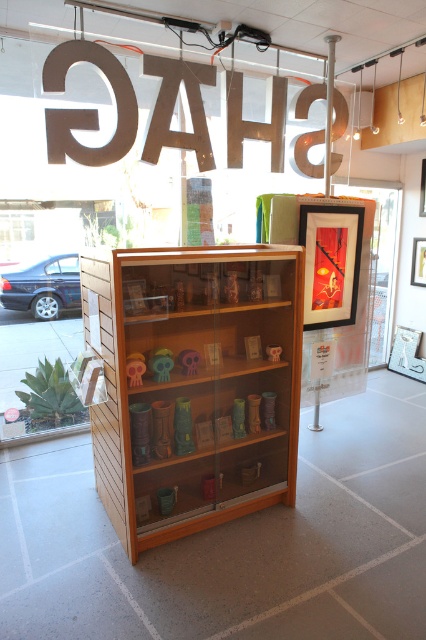
You are a customer entering the shop and want to see the items inside the transparent glass door at center. Can you see them clearly through the wooden shelf at center?

The wooden shelf at center is in front of the transparent glass door at center, so the shelf blocks the view of the items inside the transparent glass door at center.